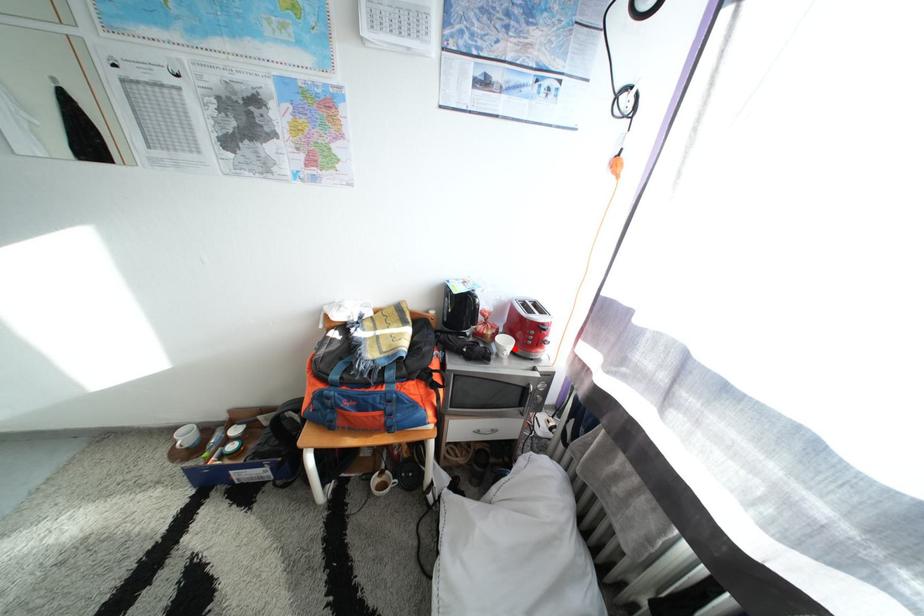
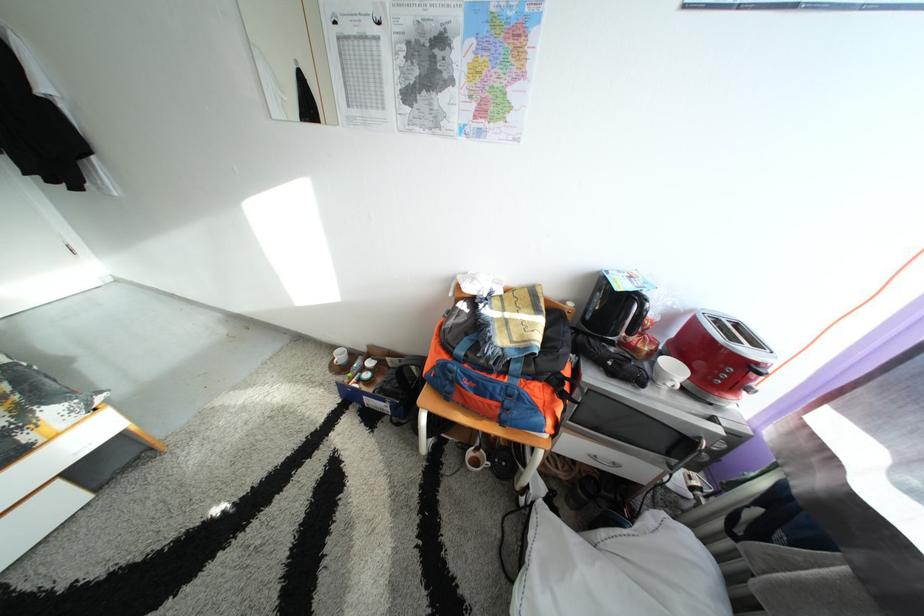
Where in the second image is the point corresponding to the highlighted location from the first image?

(683, 376)